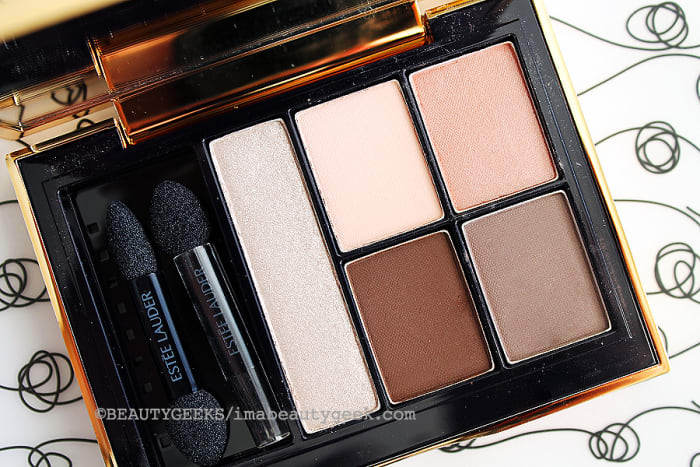
Locate an element on the screen. The height and width of the screenshot is (467, 700). makeup case is located at coordinates (102, 330).